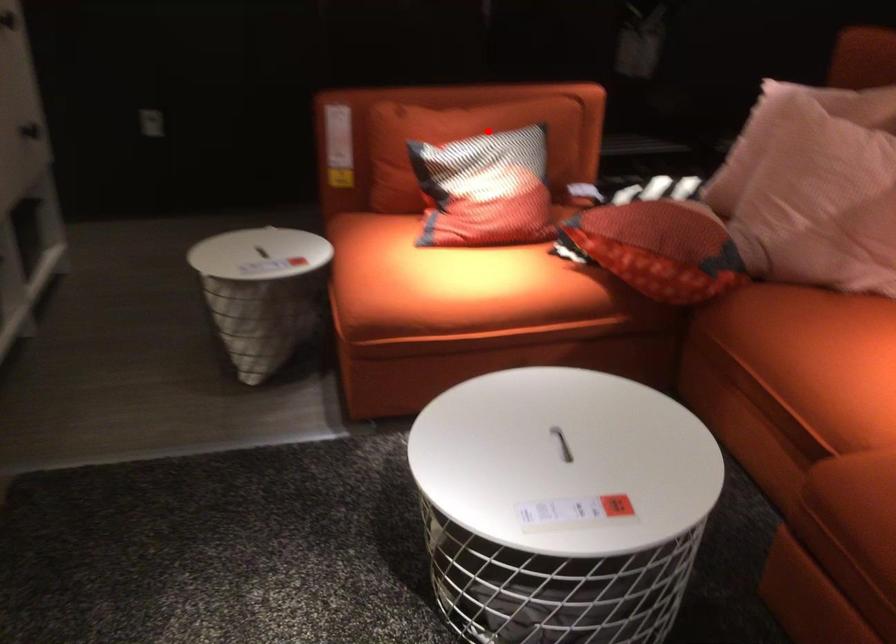
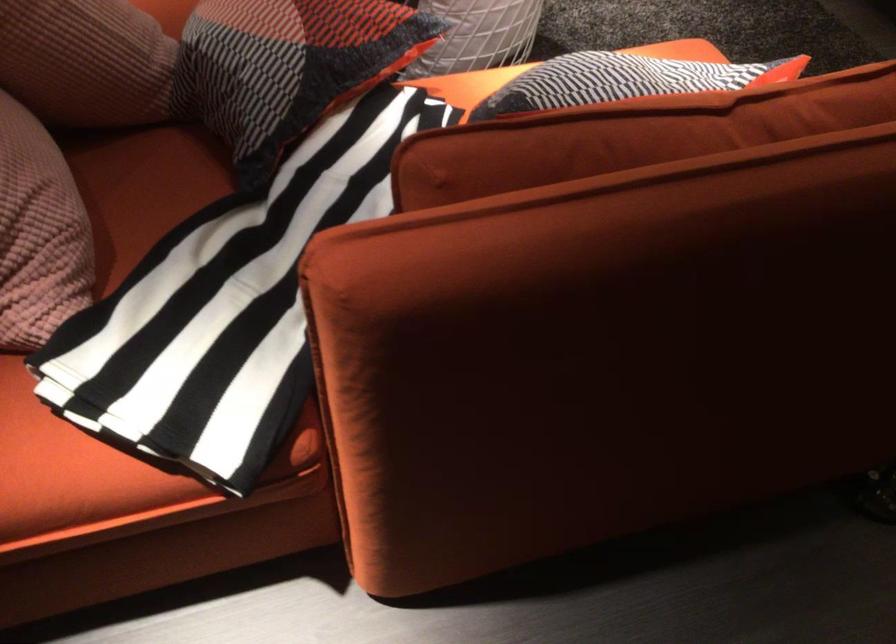
Question: I am providing you with two images of the same scene from different viewpoints. A red point is shown in image1. For the corresponding object point in image2, is it positioned nearer or farther from the camera?

Choices:
 (A) Nearer
 (B) Farther

Answer: (A)